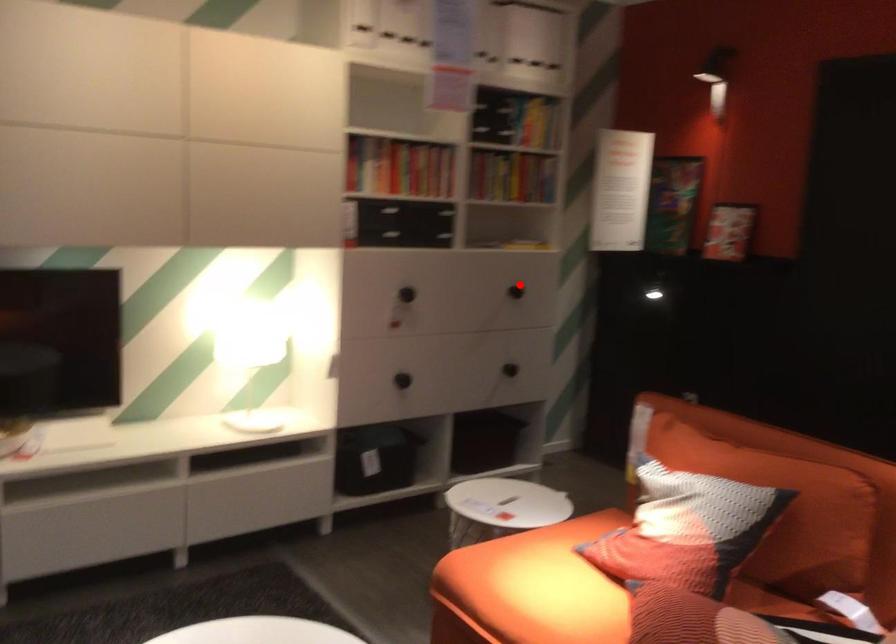
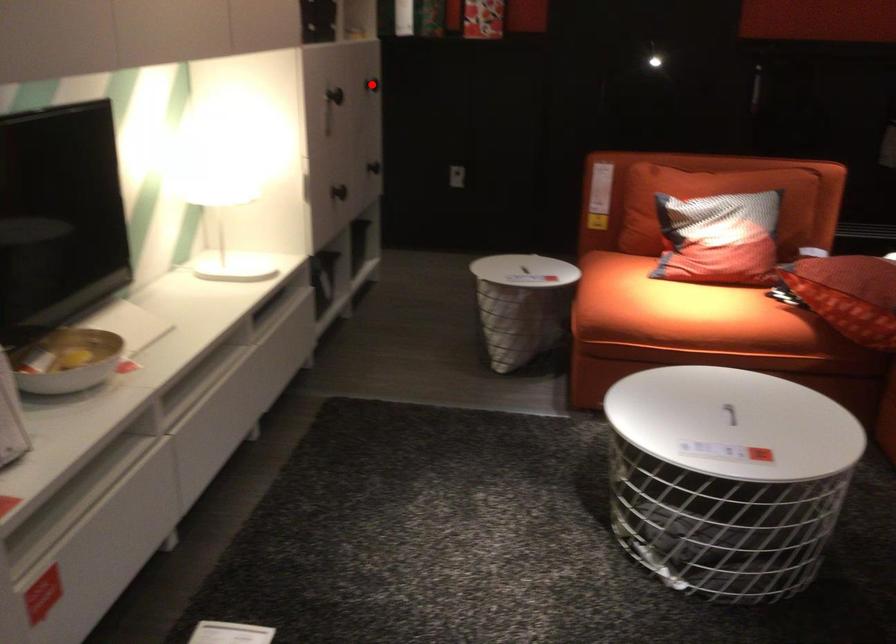
I am providing you with two images of the same scene from different viewpoints. A red point is marked on the first image and another point is marked on the second image. Is the marked point in image1 the same physical position as the marked point in image2?

Yes